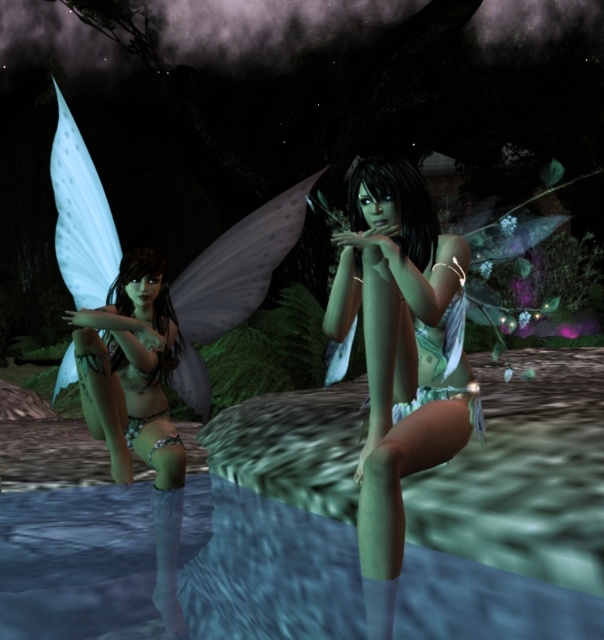
Which is in front, point (355, 564) or point (175, 513)?

Point (175, 513)

Does translucent blue water at lower center appear under translucent white wings at left?

Indeed, translucent blue water at lower center is positioned under translucent white wings at left.

Where is `translucent blue water at lower center`? The width and height of the screenshot is (604, 640). translucent blue water at lower center is located at coordinates (265, 566).

This screenshot has height=640, width=604. I want to click on translucent blue water at lower center, so click(265, 566).

Where is `green matte bikini at center`? green matte bikini at center is located at coordinates (400, 356).

Can you confirm if green matte bikini at center is positioned to the right of translucent white wings at left?

Yes, green matte bikini at center is to the right of translucent white wings at left.

This screenshot has height=640, width=604. I want to click on green matte bikini at center, so click(x=400, y=356).

The width and height of the screenshot is (604, 640). Find the location of `green matte bikini at center`. green matte bikini at center is located at coordinates [x=400, y=356].

Who is higher up, translucent blue water at lower center or green matte bikini at center?

green matte bikini at center

Who is taller, translucent blue water at lower center or green matte bikini at center?

Standing taller between the two is green matte bikini at center.

Measure the distance between point (7, 593) and camera.

The distance of point (7, 593) from camera is 2.53 meters.

This screenshot has height=640, width=604. I want to click on translucent blue water at lower center, so click(x=265, y=566).